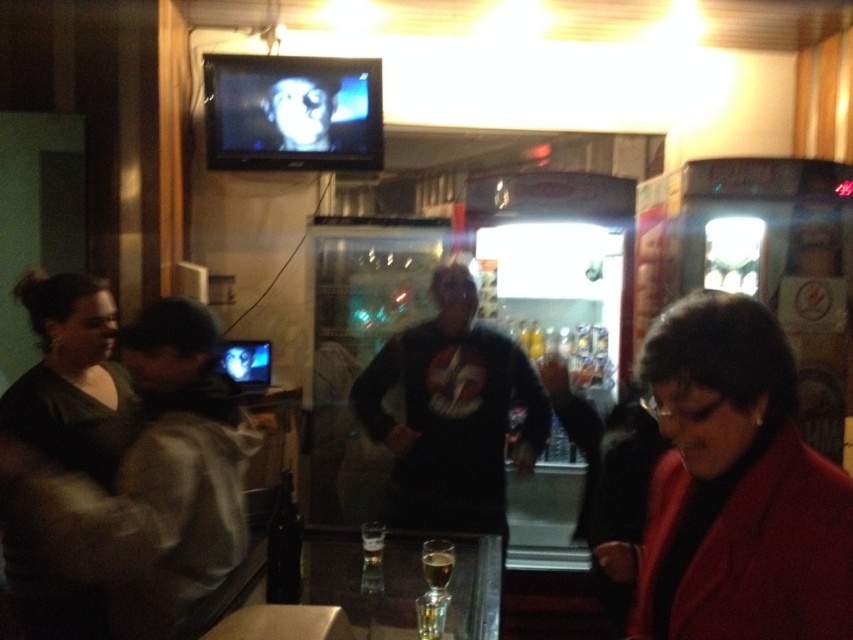
You are a photographer trying to capture a candid shot of both the matte red coat at lower right and the black matte sweatshirt at center. Since you want to ensure both subjects are fully visible in the frame, which subject should you focus on first to account for their height difference?

The matte red coat at lower right is shorter than the black matte sweatshirt at center, so you should focus on the taller black matte sweatshirt at center first to ensure it fits within the frame.

You are standing in the bar and want to find the person wearing the matte black shirt at left. According to the scene description, where should you look relative to the center of the image?

The matte black shirt at left is located at point 0.752 on the x axis and 0.177 on the y axis, so you should look to the far right and slightly up from the center of the image.